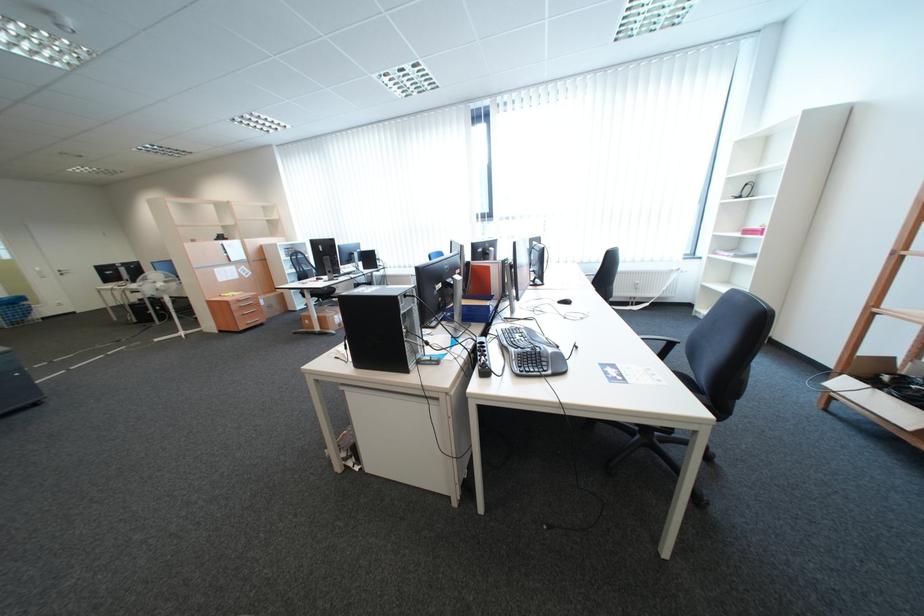
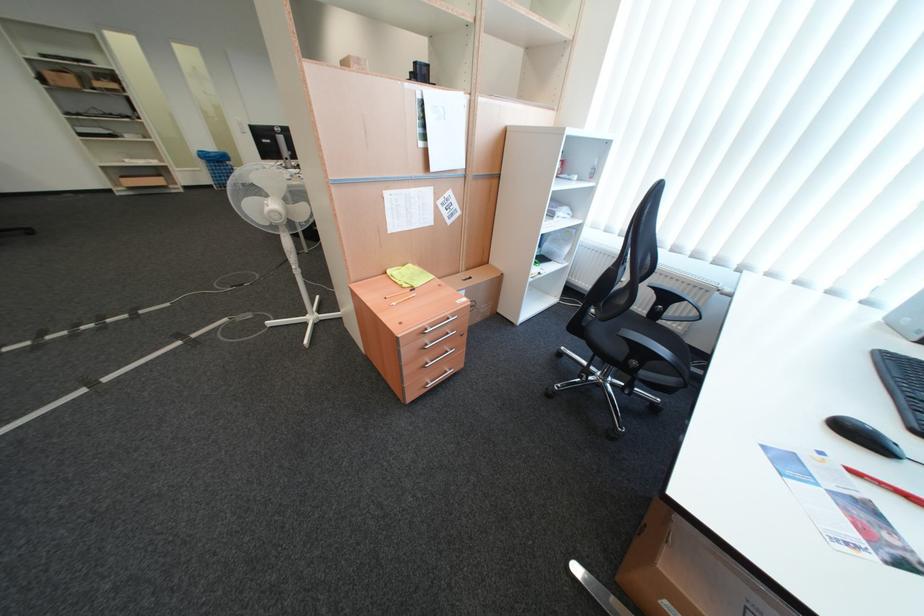
The point at (234, 297) is marked in the first image. Where is the corresponding point in the second image?

(397, 274)